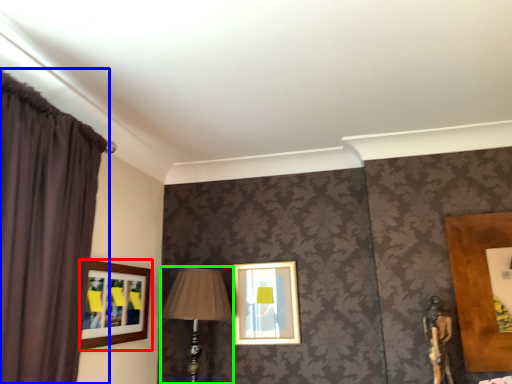
Question: Considering the real-world distances, which object is farthest from picture frame (highlighted by a red box)? curtain (highlighted by a blue box) or table lamp (highlighted by a green box)?

Choices:
 (A) curtain
 (B) table lamp

Answer: (A)